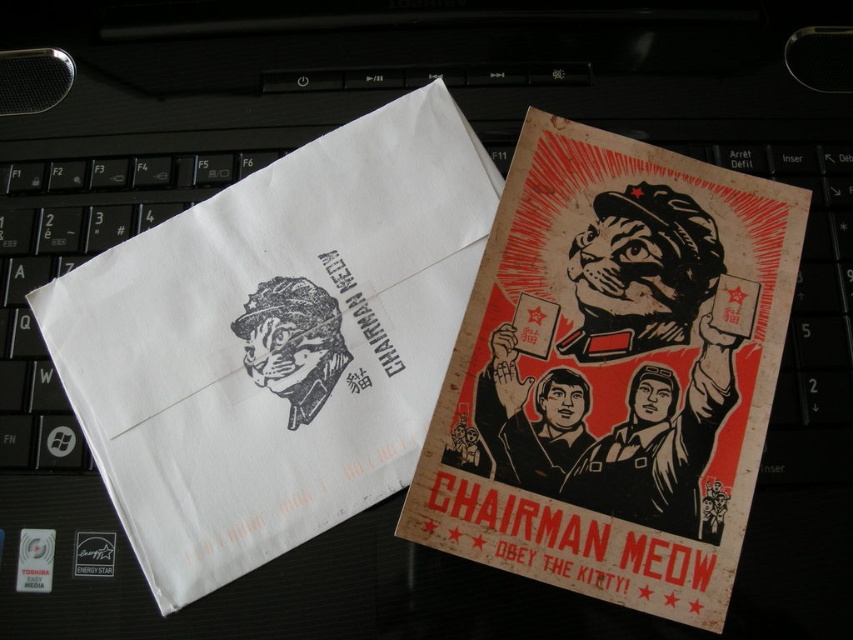
Question: Is white paper envelope at upper left bigger than wooden poster at center?

Choices:
 (A) no
 (B) yes

Answer: (B)

Question: Which of the following is the closest to the observer?

Choices:
 (A) (109, 436)
 (B) (595, 241)

Answer: (A)

Question: Is white paper envelope at upper left to the right of wooden poster at center from the viewer's perspective?

Choices:
 (A) yes
 (B) no

Answer: (B)

Question: Can you confirm if white paper envelope at upper left is positioned to the left of wooden poster at center?

Choices:
 (A) yes
 (B) no

Answer: (A)

Question: Which point is farther from the camera taking this photo?

Choices:
 (A) (202, 301)
 (B) (491, 228)

Answer: (A)

Question: Which point appears farthest from the camera in this image?

Choices:
 (A) (715, 312)
 (B) (335, 188)

Answer: (B)